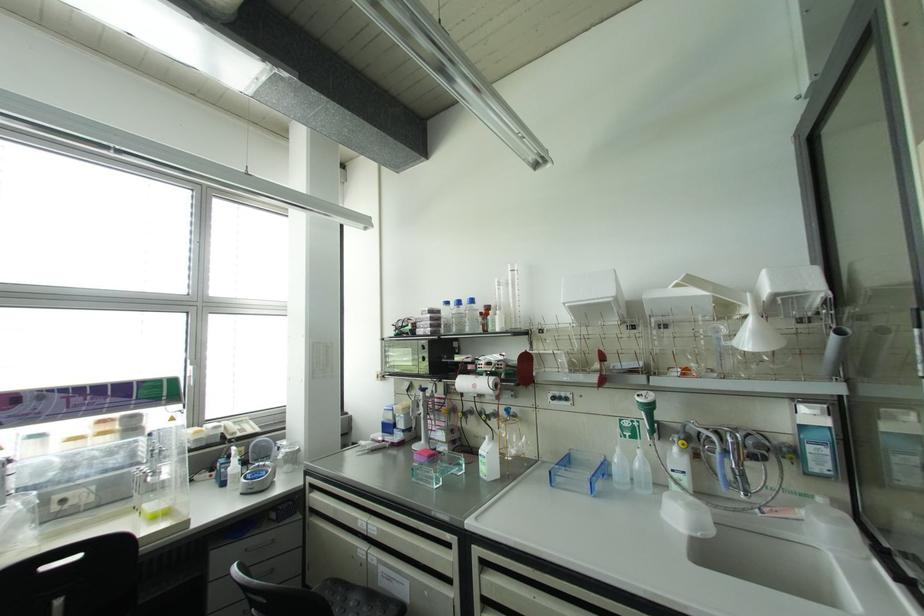
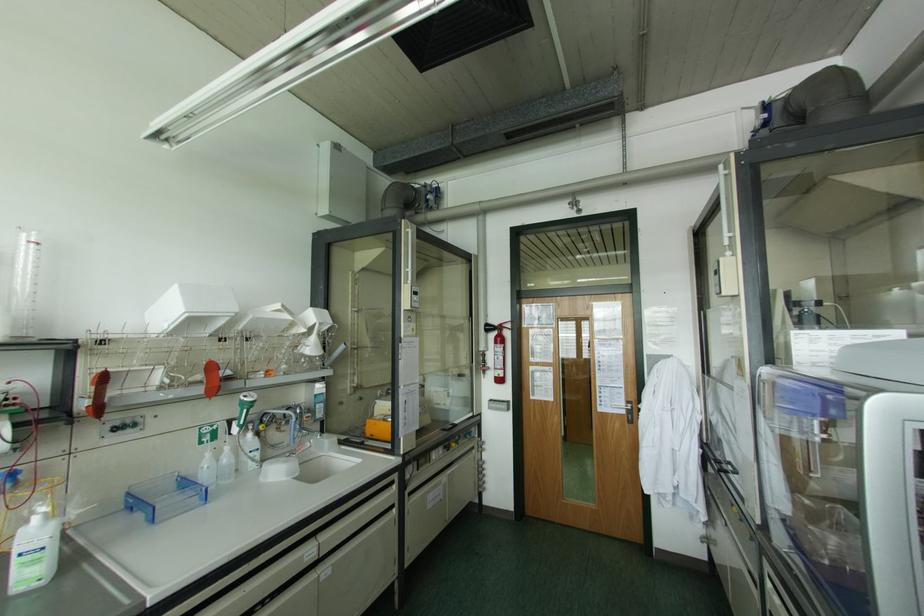
Where in the second image is the point corresponding to point 638,451 from the first image?

(226, 448)